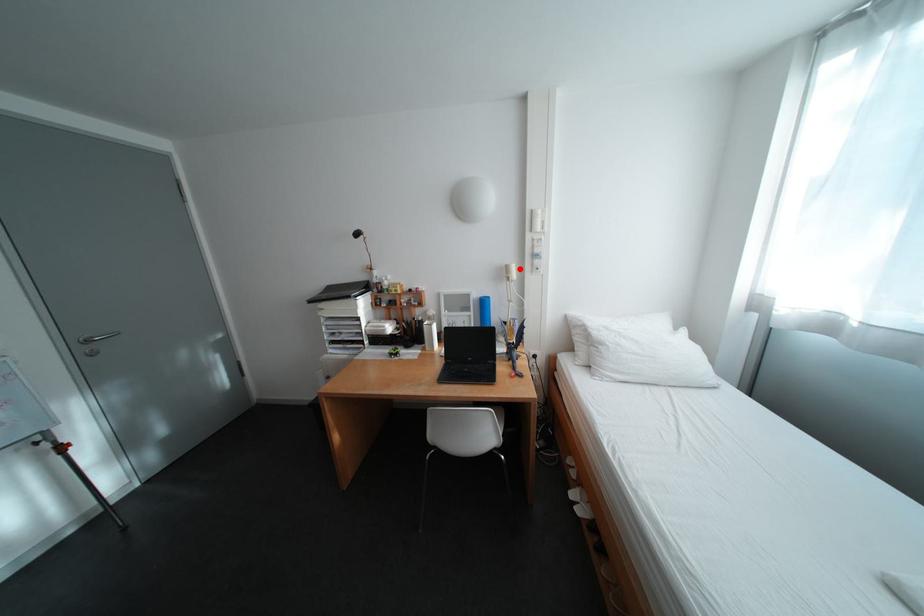
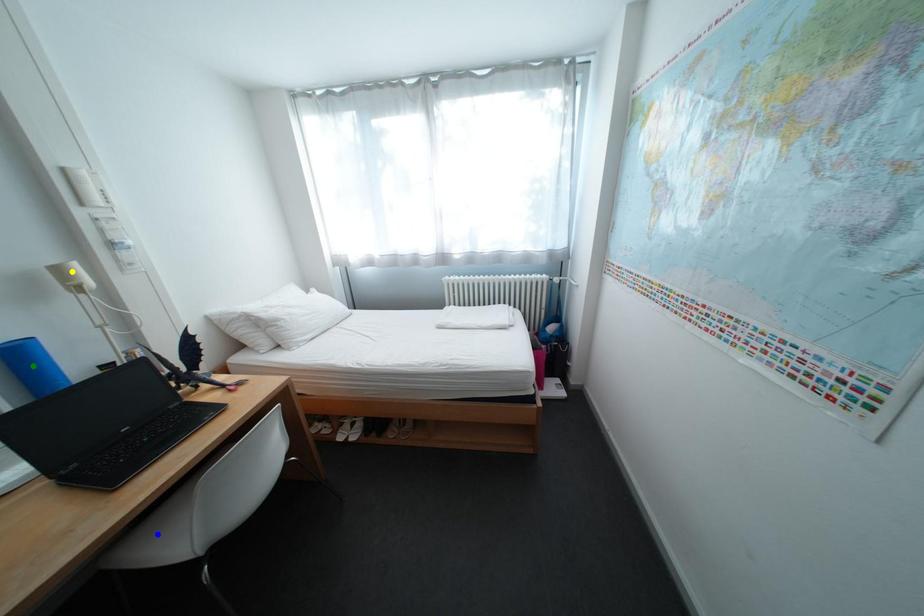
Question: I am providing you with two images of the same scene from different viewpoints. A red point is marked on the first image. You are given multiple points on the second image. Can you choose the point in image 2 that corresponds to the point in image 1?

Choices:
 (A) blue point
 (B) green point
 (C) yellow point

Answer: (C)